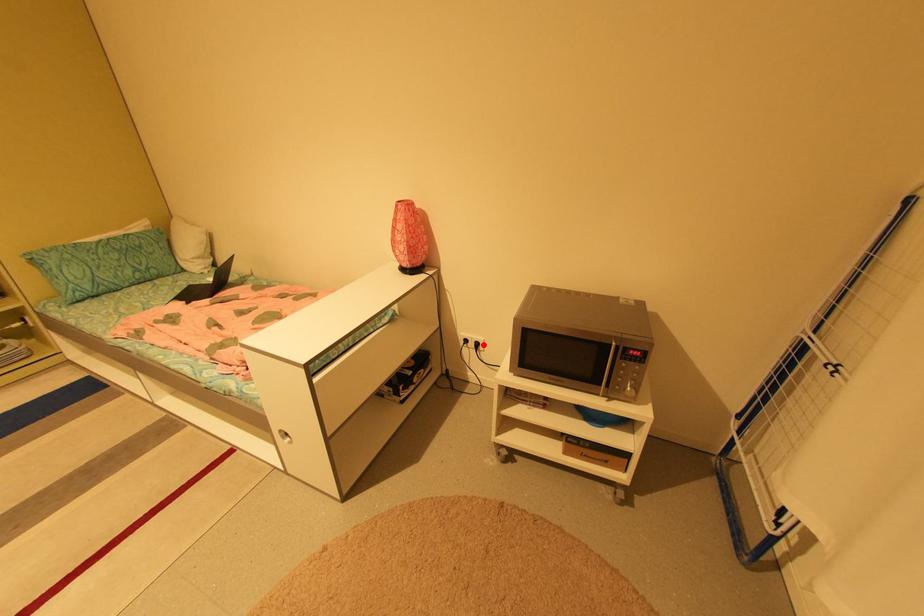
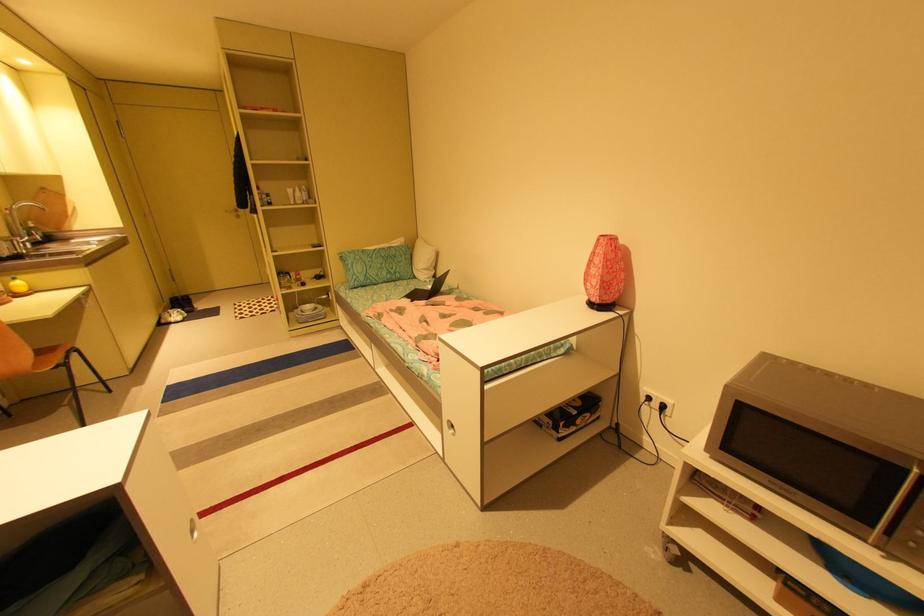
Where in the second image is the point corresponding to the highlighted location from the first image?

(669, 407)